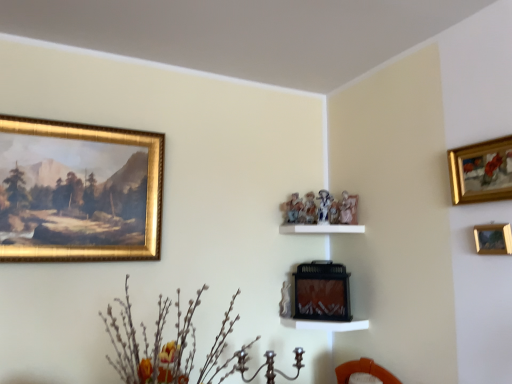
Question: Should I look upward or downward to see matte black fireplace at center, which ranks as the 1th picture frame in back-to-front order?

Choices:
 (A) up
 (B) down

Answer: (B)

Question: Is gold-framed painting at upper left, the third picture frame viewed from the front, thinner than white glossy shelf at center?

Choices:
 (A) no
 (B) yes

Answer: (B)

Question: Is gold-framed painting at upper left, acting as the second picture frame starting from the back, at the left side of white glossy shelf at center?

Choices:
 (A) no
 (B) yes

Answer: (B)

Question: Does gold-framed painting at upper left, the first picture frame in the left-to-right sequence, have a smaller size compared to white glossy shelf at center?

Choices:
 (A) yes
 (B) no

Answer: (B)

Question: Is gold-framed painting at upper left, the first picture frame in the left-to-right sequence, turned away from white glossy shelf at center?

Choices:
 (A) yes
 (B) no

Answer: (B)

Question: Is gold-framed painting at upper left, the fourth picture frame positioned from the right, touching white glossy shelf at center?

Choices:
 (A) yes
 (B) no

Answer: (B)

Question: Is gold-framed painting at upper left, the fourth picture frame positioned from the right, positioned far away from white glossy shelf at center?

Choices:
 (A) yes
 (B) no

Answer: (A)

Question: Considering the relative sizes of white glossy shelf at center and matte black fireplace at center, acting as the fourth picture frame starting from the front, in the image provided, is white glossy shelf at center smaller than matte black fireplace at center, acting as the fourth picture frame starting from the front,?

Choices:
 (A) no
 (B) yes

Answer: (B)

Question: From the image's perspective, is white glossy shelf at center under matte black fireplace at center, the 2th picture frame when ordered from left to right?

Choices:
 (A) yes
 (B) no

Answer: (B)

Question: Is white glossy shelf at center further to the viewer compared to matte black fireplace at center, which ranks as the 1th picture frame in back-to-front order?

Choices:
 (A) no
 (B) yes

Answer: (A)

Question: Is white glossy shelf at center wider than matte black fireplace at center, the 2th picture frame when ordered from left to right?

Choices:
 (A) no
 (B) yes

Answer: (B)

Question: Is white glossy shelf at center turned away from matte black fireplace at center, the 3th picture frame viewed from the right?

Choices:
 (A) no
 (B) yes

Answer: (A)

Question: Would you say white glossy shelf at center is outside matte black fireplace at center, the 3th picture frame viewed from the right?

Choices:
 (A) no
 (B) yes

Answer: (B)

Question: Is gold-framed painting at upper left, the fourth picture frame positioned from the right, at the right side of wooden picture frame at upper right, acting as the 3th picture frame starting from the left?

Choices:
 (A) yes
 (B) no

Answer: (B)